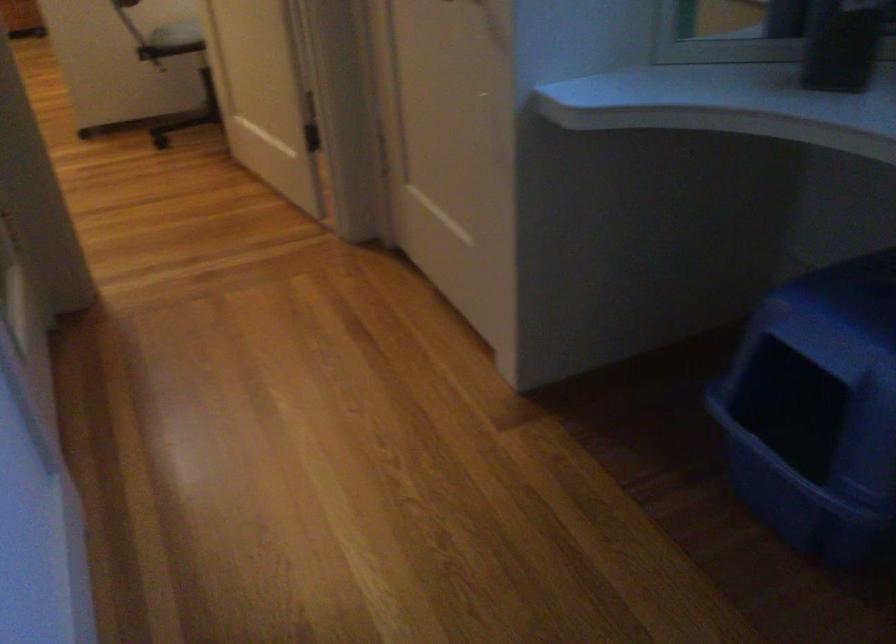
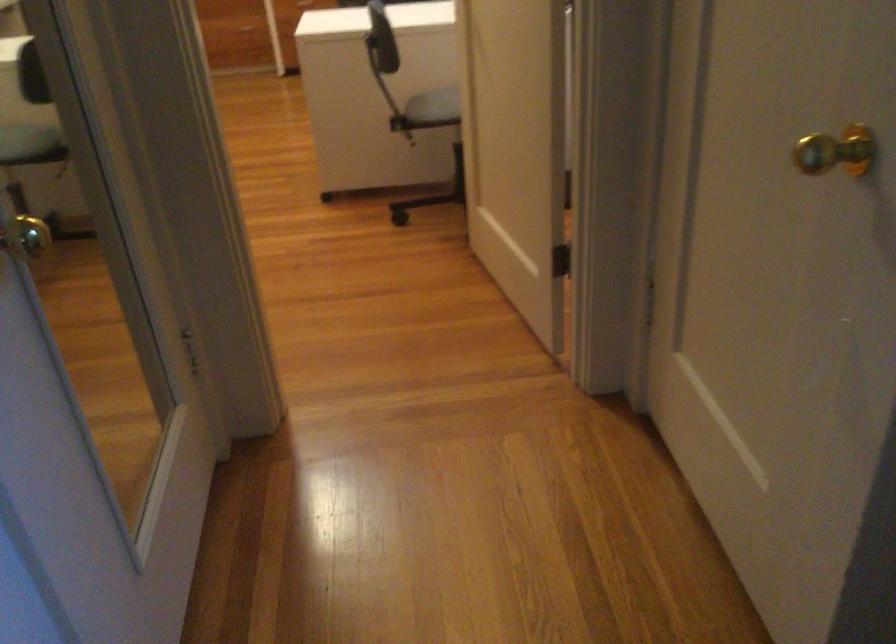
Question: The camera is either moving clockwise (left) or counter-clockwise (right) around the object. The first image is from the beginning of the video and the second image is from the end. Is the camera moving left or right when shooting the video?

Choices:
 (A) Left
 (B) Right

Answer: (B)